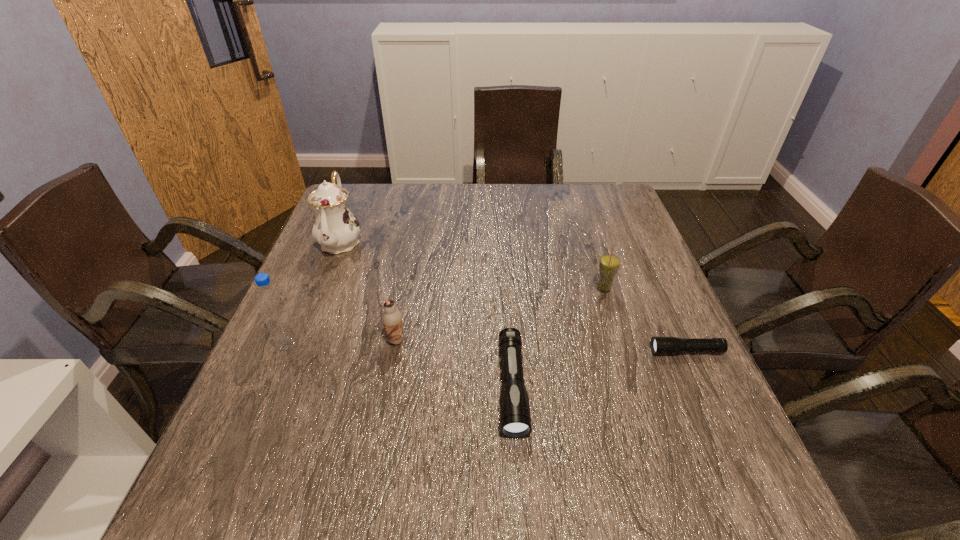
Locate an element on the screen. The height and width of the screenshot is (540, 960). chinaware that is at the left edge is located at coordinates (335, 228).

You are a GUI agent. You are given a task and a screenshot of the screen. Output one action in this format:
    pyautogui.click(x=<x>, y=<y>)
    Task: Click on the flashlight located at the right edge
    
    Given the screenshot: What is the action you would take?
    pyautogui.click(x=659, y=345)

Locate an element on the screen. This screenshot has height=540, width=960. straw for drinking at the right edge is located at coordinates (609, 264).

Find the location of a particular element. object positioned at the far left corner is located at coordinates (335, 228).

Locate an element on the screen. The image size is (960, 540). free space at the far edge is located at coordinates (384, 213).

Find the location of a particular element. The width and height of the screenshot is (960, 540). vacant area at the near edge is located at coordinates (584, 453).

At what (x,y) coordinates should I click in order to perform the action: click on free space at the left edge of the desktop. Please return your answer as a coordinate pair (x, y). Looking at the image, I should click on (335, 256).

Identify the location of vacant space at the right edge of the desktop. The image size is (960, 540). (590, 238).

The width and height of the screenshot is (960, 540). Find the location of `free location at the near left corner`. free location at the near left corner is located at coordinates (228, 453).

The height and width of the screenshot is (540, 960). Find the location of `vacant space at the far right corner of the desktop`. vacant space at the far right corner of the desktop is located at coordinates (609, 200).